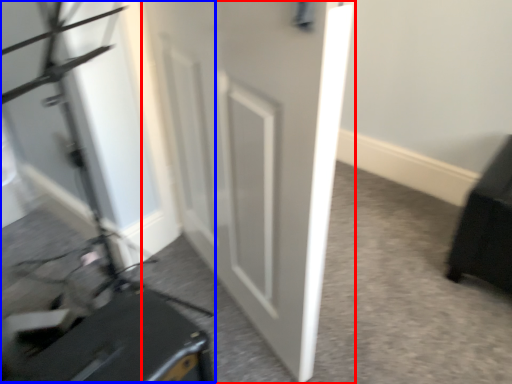
Question: Among these objects, which one is farthest to the camera, door (highlighted by a red box) or videotape (highlighted by a blue box)?

Choices:
 (A) door
 (B) videotape

Answer: (A)